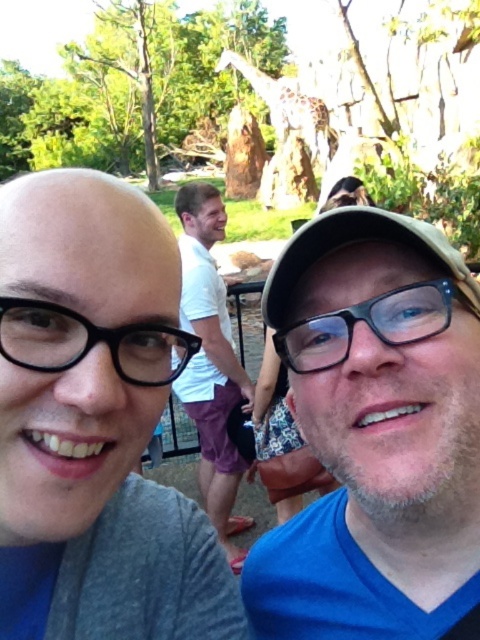
Question: Which point is farther to the camera?

Choices:
 (A) [72, 355]
 (B) [442, 371]
 (C) [17, 288]
 (D) [192, 406]

Answer: (D)

Question: Is gray matte shirt at upper left below black plastic glasses at left?

Choices:
 (A) yes
 (B) no

Answer: (A)

Question: Among these points, which one is nearest to the camera?

Choices:
 (A) (340, 580)
 (B) (207, 515)
 (C) (411, 333)
 (D) (113, 224)

Answer: (D)

Question: Does gray matte shirt at upper left have a larger size compared to blue fabric shirt at center?

Choices:
 (A) no
 (B) yes

Answer: (B)

Question: Is white cotton shirt at center smaller than black plastic glasses at center?

Choices:
 (A) yes
 (B) no

Answer: (A)

Question: Which object appears closest to the camera in this image?

Choices:
 (A) black plastic glasses at center
 (B) gray matte shirt at upper left

Answer: (B)